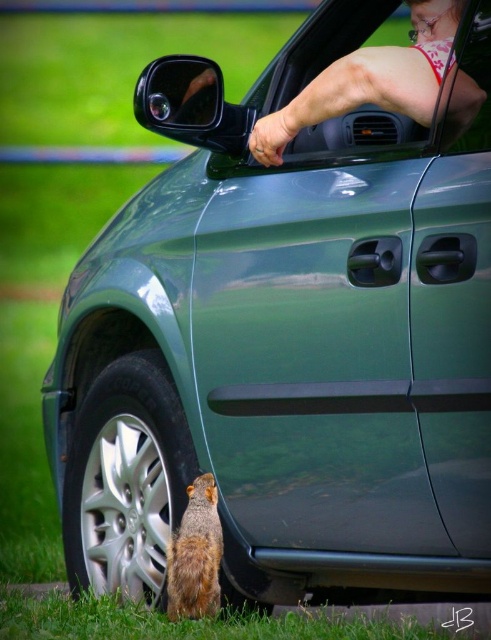
Question: Which object appears farthest from the camera in this image?

Choices:
 (A) brown fur squirrel at lower left
 (B) matte pink skin at upper right

Answer: (A)

Question: Which of the following is the closest to the observer?

Choices:
 (A) (209, 536)
 (B) (465, 125)

Answer: (B)

Question: Is matte pink skin at upper right wider than brown fur squirrel at lower left?

Choices:
 (A) no
 (B) yes

Answer: (B)

Question: Can you confirm if matte pink skin at upper right is positioned to the left of brown fur squirrel at lower left?

Choices:
 (A) no
 (B) yes

Answer: (A)

Question: Does matte pink skin at upper right appear on the left side of brown fur squirrel at lower left?

Choices:
 (A) no
 (B) yes

Answer: (A)

Question: Which point is farther to the camera?

Choices:
 (A) (421, 74)
 (B) (190, 512)

Answer: (B)